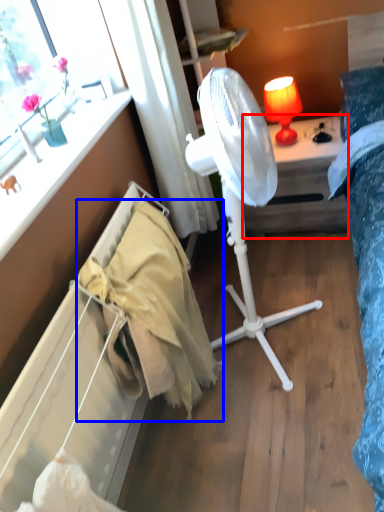
Question: Which object is closer to the camera taking this photo, desk (highlighted by a red box) or blanket (highlighted by a blue box)?

Choices:
 (A) desk
 (B) blanket

Answer: (B)